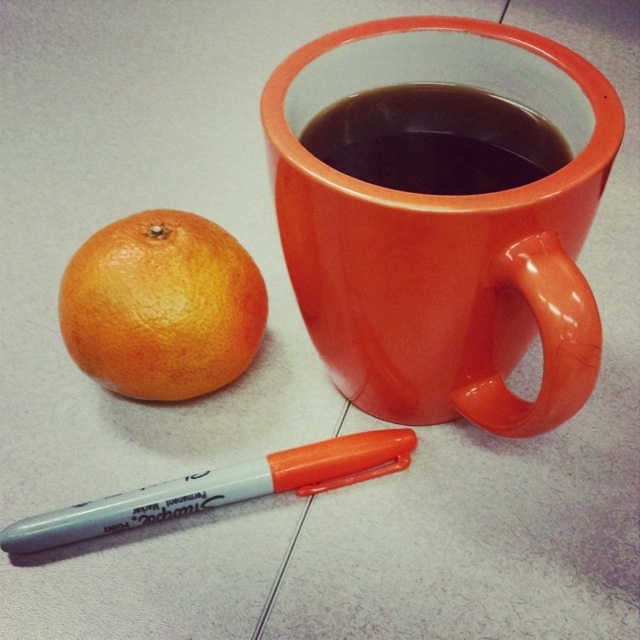
Can you confirm if black glossy mug at upper center is wider than gray plastic marker at lower left?

In fact, black glossy mug at upper center might be narrower than gray plastic marker at lower left.

Which of these two, black glossy mug at upper center or gray plastic marker at lower left, stands taller?

black glossy mug at upper center is taller.

Which is in front, point (404, 156) or point (336, 464)?

Point (404, 156) is more forward.

Locate an element on the screen. The image size is (640, 640). black glossy mug at upper center is located at coordinates (435, 140).

Who is positioned more to the right, orange matte/orange peel at left or black glossy mug at upper center?

From the viewer's perspective, black glossy mug at upper center appears more on the right side.

Who is lower down, orange matte/orange peel at left or black glossy mug at upper center?

orange matte/orange peel at left is below.

Which is behind, point (221, 369) or point (369, 141)?

Positioned behind is point (221, 369).

This screenshot has width=640, height=640. In order to click on orange matte/orange peel at left in this screenshot , I will do `click(161, 307)`.

How distant is glossy ceramic mug at upper center from orange matte/orange peel at left?

glossy ceramic mug at upper center is 30.08 centimeters away from orange matte/orange peel at left.

Which is behind, point (472, 321) or point (164, 381)?

The point (164, 381) is behind.

Between point (337, 81) and point (90, 269), which one is positioned behind?

The point (90, 269) is behind.

At what (x,y) coordinates should I click in order to perform the action: click on glossy ceramic mug at upper center. Please return your answer as a coordinate pair (x, y). The width and height of the screenshot is (640, 640). Looking at the image, I should click on (444, 230).